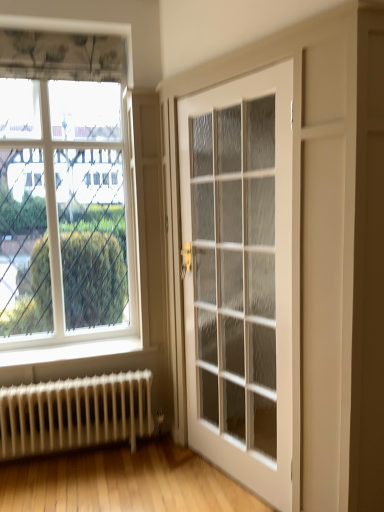
The height and width of the screenshot is (512, 384). What do you see at coordinates (75, 413) in the screenshot?
I see `white metal radiator at lower left` at bounding box center [75, 413].

This screenshot has width=384, height=512. What do you see at coordinates (64, 193) in the screenshot? I see `clear glass window at upper left` at bounding box center [64, 193].

In order to face white glossy door at center, should I rotate leftwards or rightwards?

To align with it, rotate right about 5.192°.

The width and height of the screenshot is (384, 512). Identify the location of white metal radiator at lower left. (75, 413).

Based on the photo, can you tell me how much clear glass window at upper left and white metal radiator at lower left differ in facing direction?

clear glass window at upper left and white metal radiator at lower left are facing 0.00278 degrees away from each other.

Could you tell me if clear glass window at upper left is facing white metal radiator at lower left?

No, clear glass window at upper left does not turn towards white metal radiator at lower left.

Looking at this image, which of these two, clear glass window at upper left or white metal radiator at lower left, stands shorter?

white metal radiator at lower left is shorter.

You are a GUI agent. You are given a task and a screenshot of the screen. Output one action in this format:
    pyautogui.click(x=<x>, y=<y>)
    Task: Click on the window that is behind the white metal radiator at lower left
    
    Given the screenshot: What is the action you would take?
    pyautogui.click(x=64, y=193)

The width and height of the screenshot is (384, 512). I want to click on window that appears on the left of white glossy door at center, so click(x=64, y=193).

From the image's perspective, would you say white glossy door at center is shown under clear glass window at upper left?

Yes.

Is white glossy door at center turned away from clear glass window at upper left?

white glossy door at center is not turned away from clear glass window at upper left.

Can you tell me how much white metal radiator at lower left and white glossy door at center differ in facing direction?

The angular difference between white metal radiator at lower left and white glossy door at center is 68.2 degrees.

Based on the photo, is white metal radiator at lower left looking in the opposite direction of white glossy door at center?

No, white metal radiator at lower left is not facing the opposite direction of white glossy door at center.

Measure the distance from white metal radiator at lower left to white glossy door at center.

white metal radiator at lower left is 32.74 inches from white glossy door at center.

Are white metal radiator at lower left and white glossy door at center located far from each other?

No, white metal radiator at lower left is not far from white glossy door at center.

Is white glossy door at center completely or partially inside clear glass window at upper left?

No.

Considering the positions of objects clear glass window at upper left and white glossy door at center in the image provided, who is in front, clear glass window at upper left or white glossy door at center?

white glossy door at center is closer to the camera.

Where is `door on the right of the clear glass window at upper left`? Image resolution: width=384 pixels, height=512 pixels. door on the right of the clear glass window at upper left is located at coordinates (240, 277).

Could you tell me if white glossy door at center is facing white metal radiator at lower left?

No, white glossy door at center is not facing towards white metal radiator at lower left.

From the image's perspective, which is below, white glossy door at center or white metal radiator at lower left?

white metal radiator at lower left appears lower in the image.

Between point (236, 210) and point (75, 384), which one is positioned behind?

The point (236, 210) is more distant.

From the image's perspective, would you say white metal radiator at lower left is shown under clear glass window at upper left?

Yes, from the image's perspective, white metal radiator at lower left is below clear glass window at upper left.

In terms of width, does white metal radiator at lower left look wider or thinner when compared to clear glass window at upper left?

In the image, white metal radiator at lower left appears to be wider than clear glass window at upper left.

Would you say white metal radiator at lower left contains clear glass window at upper left?

Actually, clear glass window at upper left is outside white metal radiator at lower left.

Find the location of a particular element. The width and height of the screenshot is (384, 512). radiator lying below the clear glass window at upper left (from the image's perspective) is located at coordinates (75, 413).

Where is `window that is above the white glossy door at center (from a real-world perspective)`? window that is above the white glossy door at center (from a real-world perspective) is located at coordinates (64, 193).

Estimate the real-world distances between objects in this image. Which object is further from clear glass window at upper left, white glossy door at center or white metal radiator at lower left?

Based on the image, white glossy door at center appears to be further to clear glass window at upper left.

From the image, which object appears to be nearer to white metal radiator at lower left, white glossy door at center or clear glass window at upper left?

Among the two, clear glass window at upper left is located nearer to white metal radiator at lower left.

Based on their spatial positions, is clear glass window at upper left or white metal radiator at lower left further from white glossy door at center?

white metal radiator at lower left lies further to white glossy door at center than the other object.

From the image, which object appears to be farther from clear glass window at upper left, white metal radiator at lower left or white glossy door at center?

Based on the image, white glossy door at center appears to be further to clear glass window at upper left.

Looking at the image, which one is located further to white glossy door at center, white metal radiator at lower left or clear glass window at upper left?

Based on the image, white metal radiator at lower left appears to be further to white glossy door at center.

From the image, which object appears to be nearer to white metal radiator at lower left, clear glass window at upper left or white glossy door at center?

Among the two, clear glass window at upper left is located nearer to white metal radiator at lower left.

In order to click on door between clear glass window at upper left and white metal radiator at lower left vertically in this screenshot , I will do `click(240, 277)`.